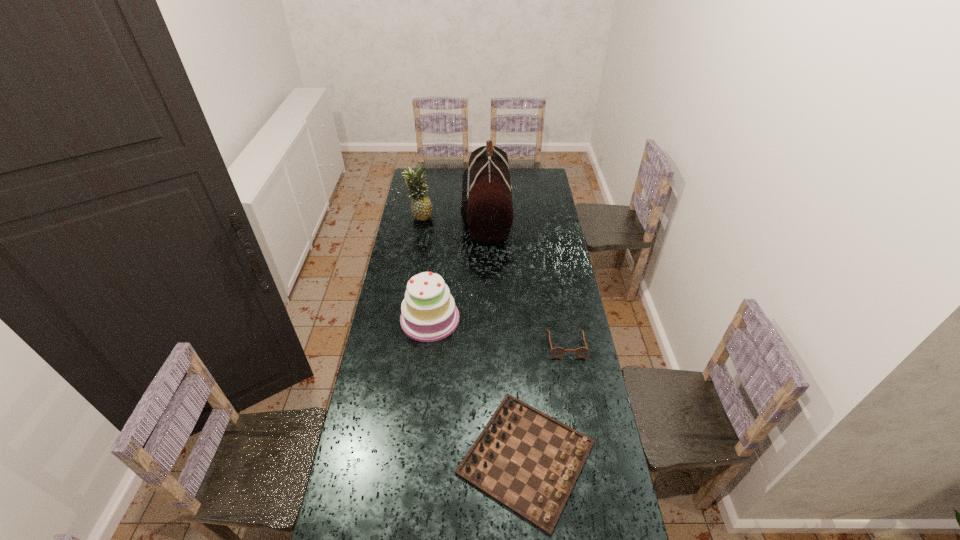
In order to click on vacant point at the right edge in this screenshot , I will do `click(586, 339)`.

The image size is (960, 540). In order to click on free space at the far left corner in this screenshot , I will do `click(423, 172)`.

You are a GUI agent. You are given a task and a screenshot of the screen. Output one action in this format:
    pyautogui.click(x=<x>, y=<y>)
    Task: Click on the free space at the far right corner
    
    Given the screenshot: What is the action you would take?
    pyautogui.click(x=542, y=176)

Where is `blank region between the spectacles and the third tallest object`? blank region between the spectacles and the third tallest object is located at coordinates (498, 332).

Where is `free space between the nearest object and the shortest object`? Image resolution: width=960 pixels, height=540 pixels. free space between the nearest object and the shortest object is located at coordinates (546, 401).

Where is `vacant area between the third shortest object and the tallest object`? Image resolution: width=960 pixels, height=540 pixels. vacant area between the third shortest object and the tallest object is located at coordinates (458, 266).

Identify the location of free spot between the third tallest object and the spectacles. (498, 332).

Identify the location of vacant space in between the chessboard and the spectacles. tap(546, 401).

Identify the location of unoccupied position between the chessboard and the shortest object. (546, 401).

Where is `vacant area that lies between the spectacles and the cake`? The height and width of the screenshot is (540, 960). vacant area that lies between the spectacles and the cake is located at coordinates (498, 332).